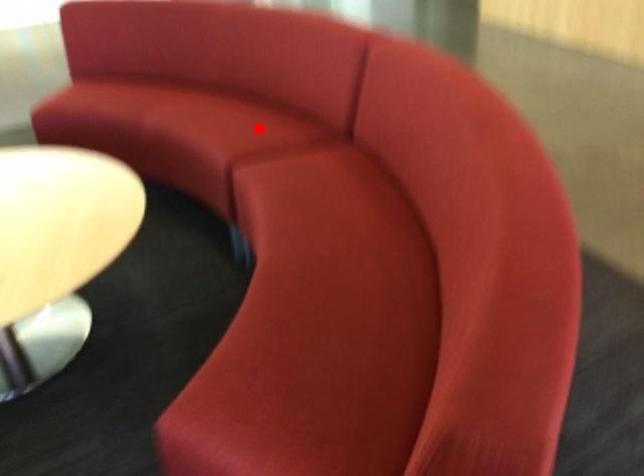
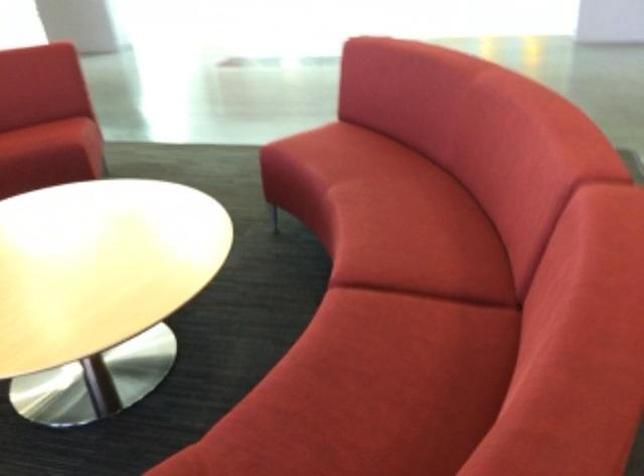
Question: I am providing you with two images of the same scene from different viewpoints. Image1 has a red point marked. In image2, the corresponding 3D location appears at what relative position? Reply with the corresponding letter.

Choices:
 (A) Closer
 (B) Farther

Answer: (A)